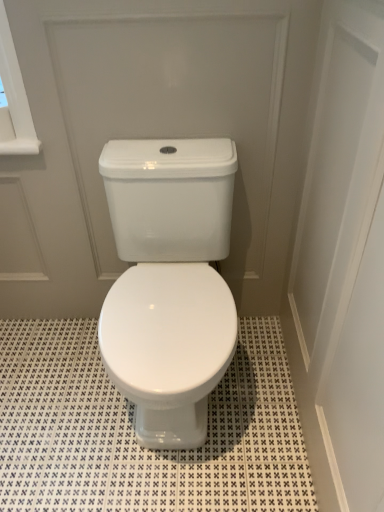
Question: Relative to white glossy toilet at center, acting as the 1th screen door starting from the left, is white glossy tile at center in front or behind?

Choices:
 (A) behind
 (B) front

Answer: (A)

Question: Is white glossy tile at center bigger or smaller than white glossy toilet at center, acting as the 1th screen door starting from the left?

Choices:
 (A) big
 (B) small

Answer: (B)

Question: Estimate the real-world distances between objects in this image. Which object is farther from the white glossy door at upper center, placed as the 1th screen door when sorted from right to left?

Choices:
 (A) white glossy tile at center
 (B) white glossy toilet at center, acting as the 1th screen door starting from the left

Answer: (A)

Question: Which of these objects is positioned closest to the white glossy tile at center?

Choices:
 (A) white glossy door at upper center, the 2th screen door positioned from the left
 (B) white glossy toilet at center, the 2th screen door when ordered from right to left

Answer: (A)